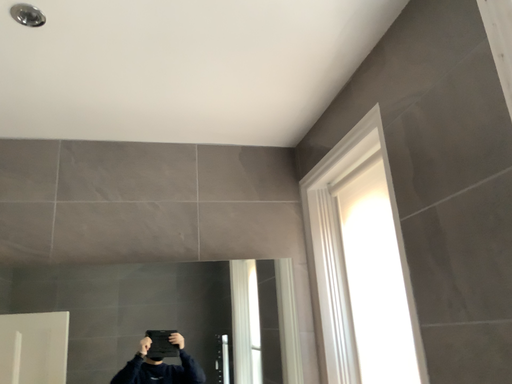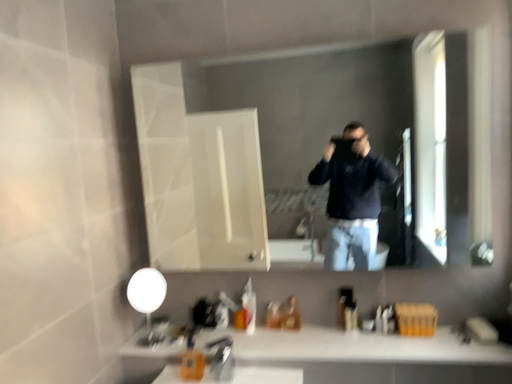
Question: How did the camera likely rotate when shooting the video?

Choices:
 (A) rotated upward
 (B) rotated downward

Answer: (B)